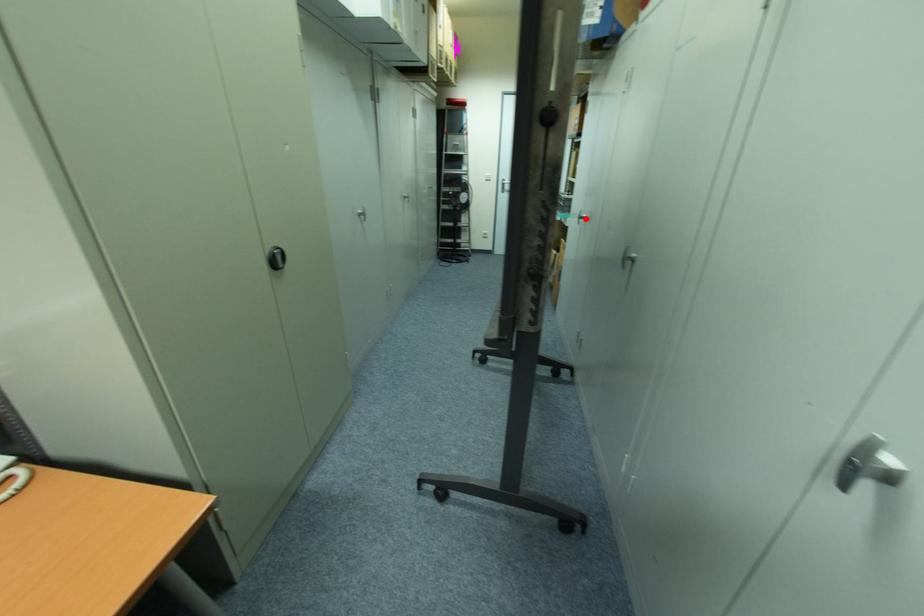
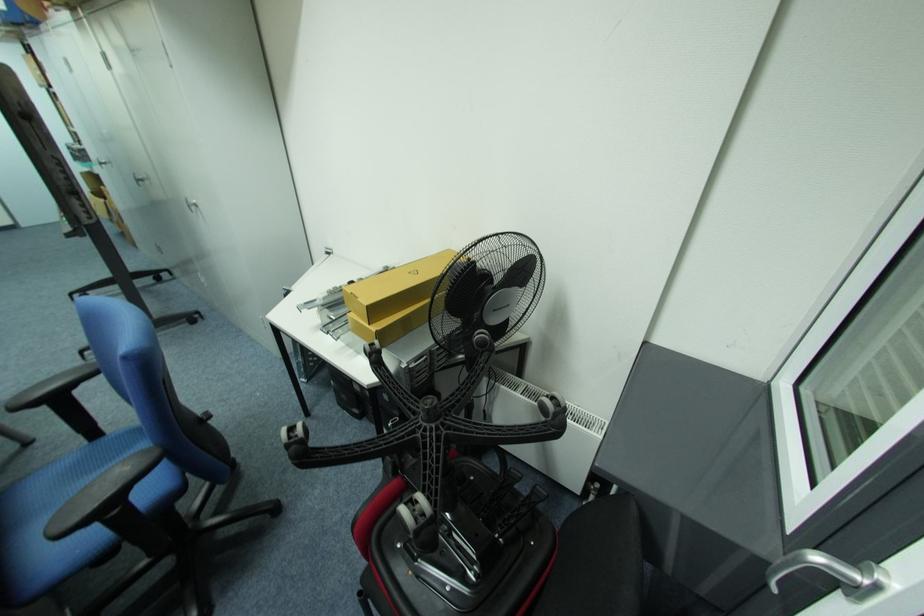
Find the pixel in the second image that matches the highlighted location in the first image.

(105, 164)